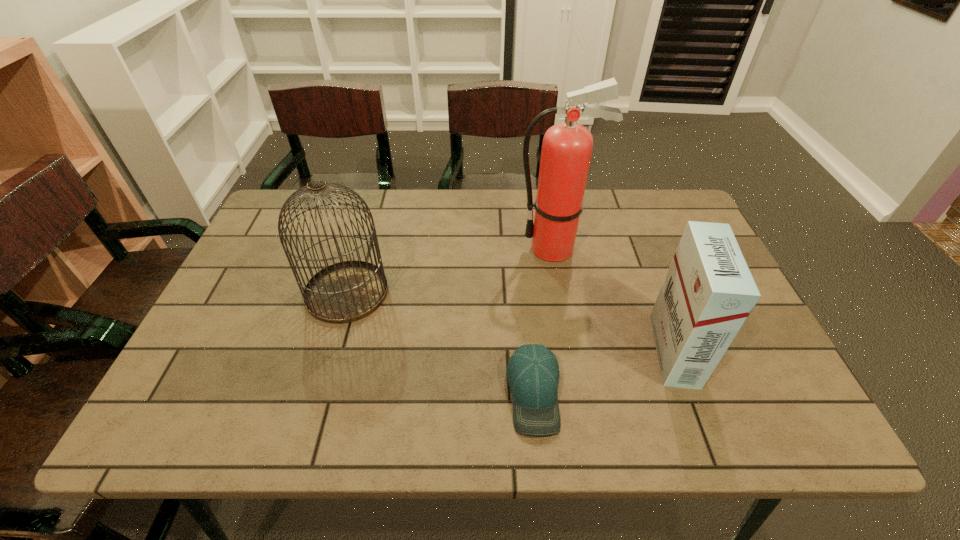
This screenshot has width=960, height=540. Identify the location of the farthest object. (567, 147).

The image size is (960, 540). Find the location of `fire extinguisher`. fire extinguisher is located at coordinates (567, 147).

You are a GUI agent. You are given a task and a screenshot of the screen. Output one action in this format:
    pyautogui.click(x=<x>, y=<y>)
    Task: Click on the birdcage
    
    Given the screenshot: What is the action you would take?
    pyautogui.click(x=347, y=291)

Where is `cigarette case`? The image size is (960, 540). cigarette case is located at coordinates (708, 293).

Where is `baseball cap`? Image resolution: width=960 pixels, height=540 pixels. baseball cap is located at coordinates (533, 372).

This screenshot has height=540, width=960. Find the location of `blank space located on the hose direction of the fire extinguisher`. blank space located on the hose direction of the fire extinguisher is located at coordinates (431, 248).

Find the location of `free space located on the hose direction of the fire extinguisher`. free space located on the hose direction of the fire extinguisher is located at coordinates (378, 248).

Image resolution: width=960 pixels, height=540 pixels. Identify the location of vacant area situated on the hose direction of the fire extinguisher. (420, 248).

At what (x,y) coordinates should I click in order to perform the action: click on free location located on the left of the birdcage. Please return your answer as a coordinate pair (x, y). Looking at the image, I should click on (240, 292).

At what (x,y) coordinates should I click in order to perform the action: click on vacant region located on the left of the rightmost object. Please return your answer as a coordinate pair (x, y). The image size is (960, 540). Looking at the image, I should click on (564, 350).